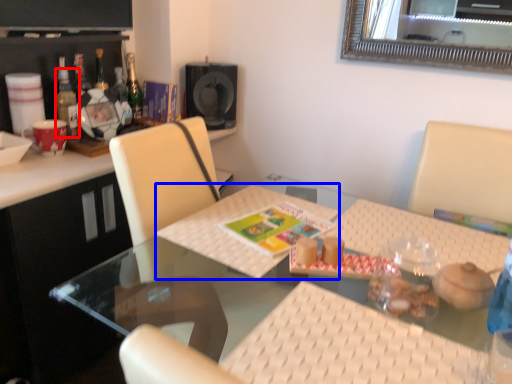
Question: Among these objects, which one is farthest to the camera, bottle (highlighted by a red box) or place mat (highlighted by a blue box)?

Choices:
 (A) bottle
 (B) place mat

Answer: (A)